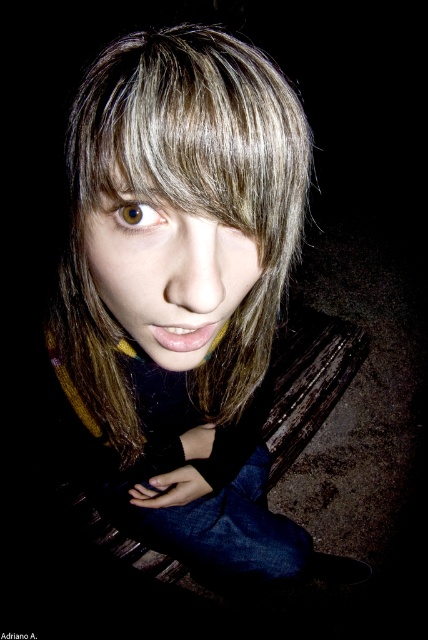
Who is shorter, smooth brown hair at center or smooth skin face at center?

With less height is smooth skin face at center.

Who is more forward, (171, 232) or (168, 291)?

Point (171, 232) is in front.

What are the coordinates of `smooth brown hair at center` in the screenshot? It's located at (184, 296).

Can you confirm if smooth skin face at center is positioned below brown matte eye at center?

Yes.

Which is more to the right, smooth skin face at center or brown matte eye at center?

smooth skin face at center

At what (x,y) coordinates should I click in order to perform the action: click on smooth skin face at center. Please return your answer as a coordinate pair (x, y). This screenshot has height=640, width=428. Looking at the image, I should click on (166, 272).

The width and height of the screenshot is (428, 640). In order to click on smooth brown hair at center in this screenshot , I will do `click(184, 296)`.

Measure the distance from smooth brown hair at center to brown matte eye at center.

53.39 centimeters

Describe the element at coordinates (184, 296) in the screenshot. I see `smooth brown hair at center` at that location.

The image size is (428, 640). In order to click on smooth brown hair at center in this screenshot , I will do `click(184, 296)`.